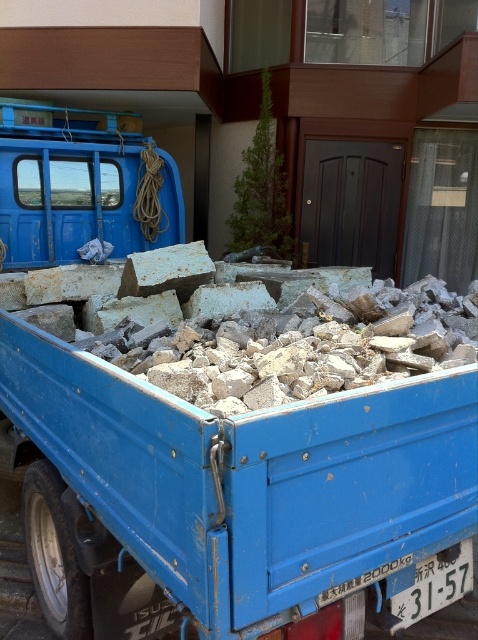
You are a delivery driver who needs to park your truck next to the matte blue truck at upper left. The parking space can only accommodate vehicles narrower than the rusty concrete block at center. Can your truck fit in the space?

The matte blue truck at upper left is wider than the rusty concrete block at center. Since the parking space can only accommodate vehicles narrower than the rusty concrete block at center, your truck cannot fit in the space.

You are a delivery driver who needs to park your truck in the same area. You see the blue matte truck at center and the matte blue truck at upper left. Which truck takes up more space in the parking area?

The blue matte truck at center takes up more space in the parking area because it is larger in size than the matte blue truck at upper left.

You are standing at the entrance of the building. You need to move the blue matte truck at center to the side of the building. Which direction should you move it to avoid blocking the entrance?

The blue matte truck at center is located at point (241, 470), so you should move it to the left side of the building to avoid blocking the entrance.